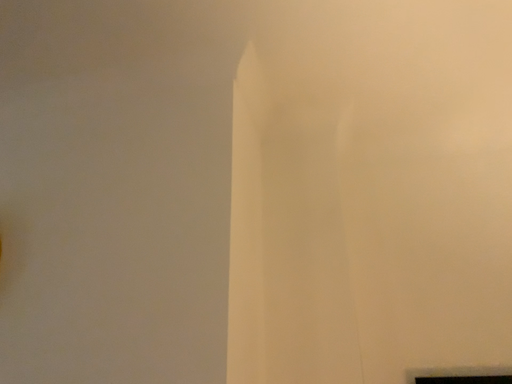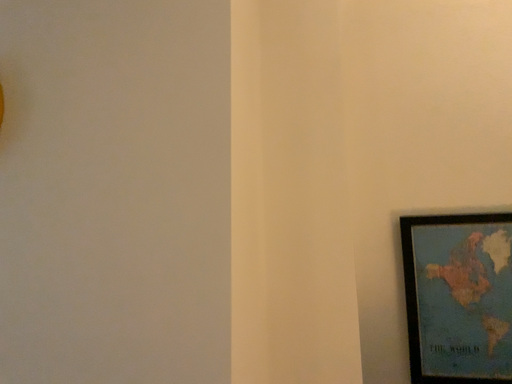
Question: How did the camera likely rotate when shooting the video?

Choices:
 (A) rotated downward
 (B) rotated upward

Answer: (A)